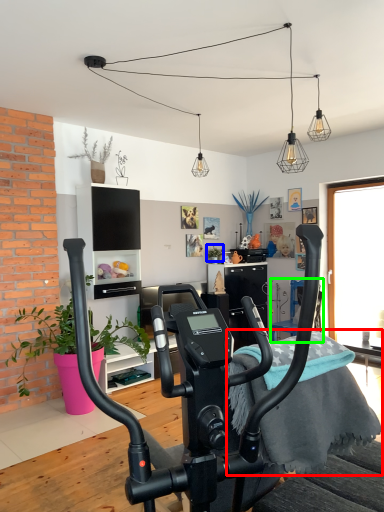
Question: Estimate the real-world distances between objects in this image. Which object is closer to bedding (highlighted by a red box), plant (highlighted by a blue box) or armchair (highlighted by a green box)?

Choices:
 (A) plant
 (B) armchair

Answer: (B)